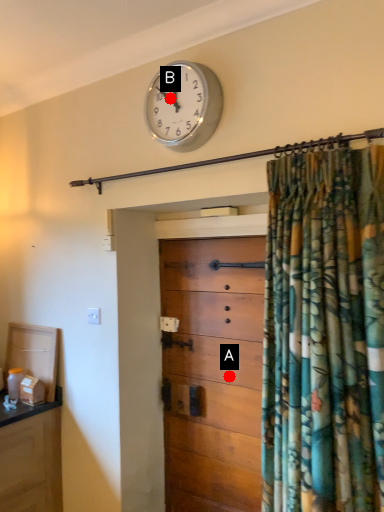
Question: Two points are circled on the image, labeled by A and B beside each circle. Among these points, which one is nearest to the camera?

Choices:
 (A) A is closer
 (B) B is closer

Answer: (B)